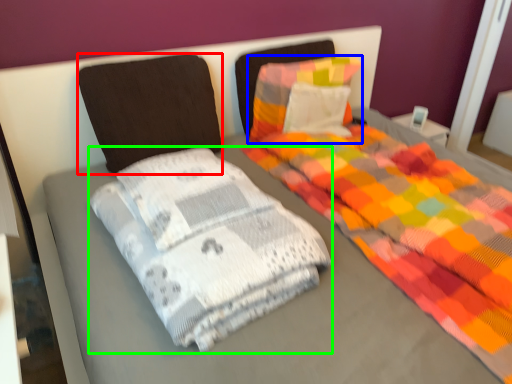
Question: Which is farther away from pillow (highlighted by a red box)? pillow (highlighted by a blue box) or material (highlighted by a green box)?

Choices:
 (A) pillow
 (B) material

Answer: (B)